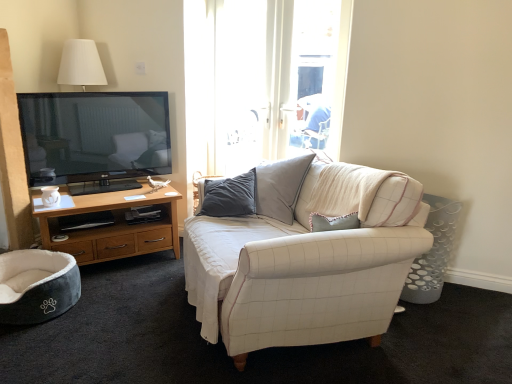
Find the location of a particular element. The width and height of the screenshot is (512, 384). vacant area to the right of gray plush pet bed at lower left is located at coordinates (106, 311).